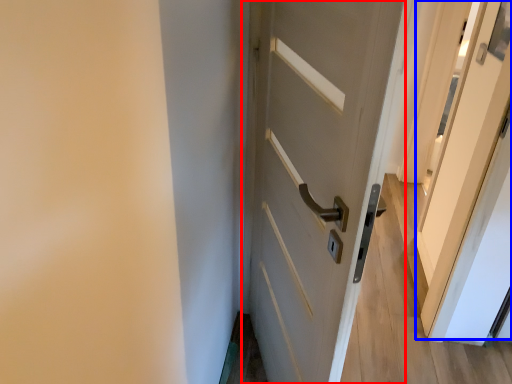
Question: Among these objects, which one is farthest to the camera, door (highlighted by a red box) or screen door (highlighted by a blue box)?

Choices:
 (A) door
 (B) screen door

Answer: (B)